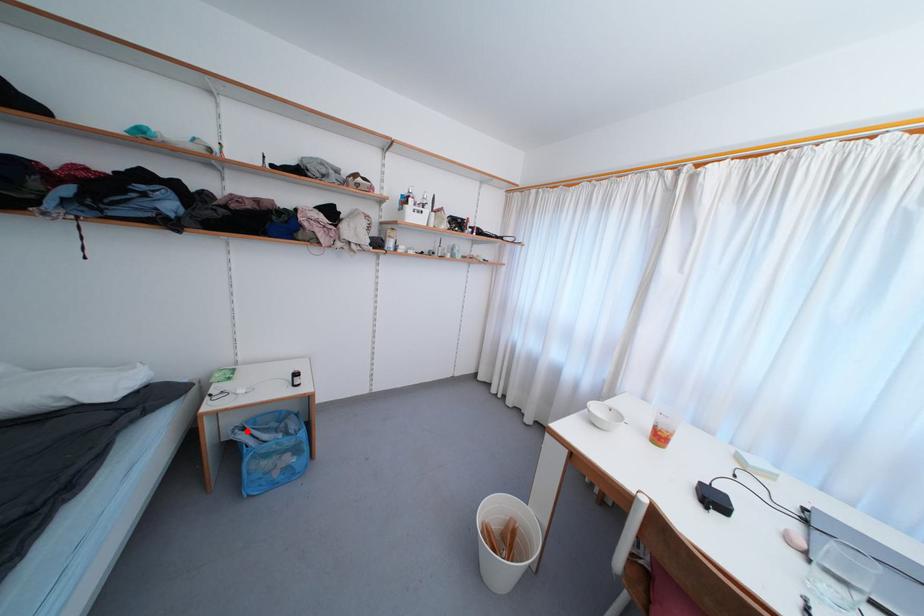
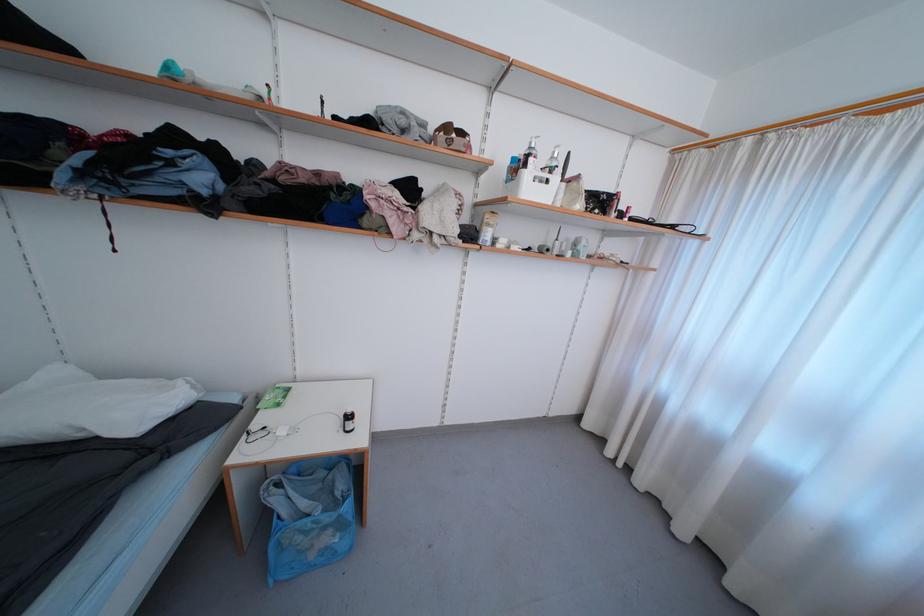
Where in the second image is the point corresponding to the highlighted location from the first image?

(284, 488)